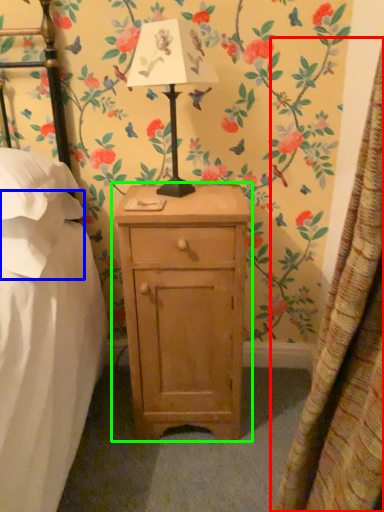
Question: Which is nearer to the curtain (highlighted by a red box)? pillow (highlighted by a blue box) or nightstand (highlighted by a green box).

Choices:
 (A) pillow
 (B) nightstand

Answer: (B)